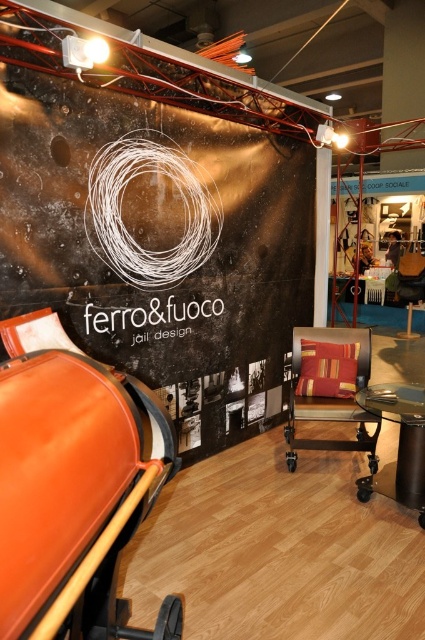
Is metallic wall at center further to camera compared to metallic glass table at lower right?

No, it is in front of metallic glass table at lower right.

Between point (190, 336) and point (393, 499), which one is positioned in front?

Positioned in front is point (393, 499).

At what (x,y) coordinates should I click in order to perform the action: click on metallic wall at center. Please return your answer as a coordinate pair (x, y). The image size is (425, 640). Looking at the image, I should click on (186, 276).

Does metallic wall at center have a greater width compared to textured beige swivel chair at center?

Yes.

Does metallic wall at center appear over textured beige swivel chair at center?

Yes, metallic wall at center is above textured beige swivel chair at center.

Identify the location of metallic wall at center. This screenshot has width=425, height=640. (186, 276).

Which is behind, point (300, 442) or point (385, 417)?

Positioned behind is point (300, 442).

Does point (294, 410) lie in front of point (413, 486)?

No, (294, 410) is further to viewer.

The image size is (425, 640). I want to click on textured beige swivel chair at center, so click(329, 388).